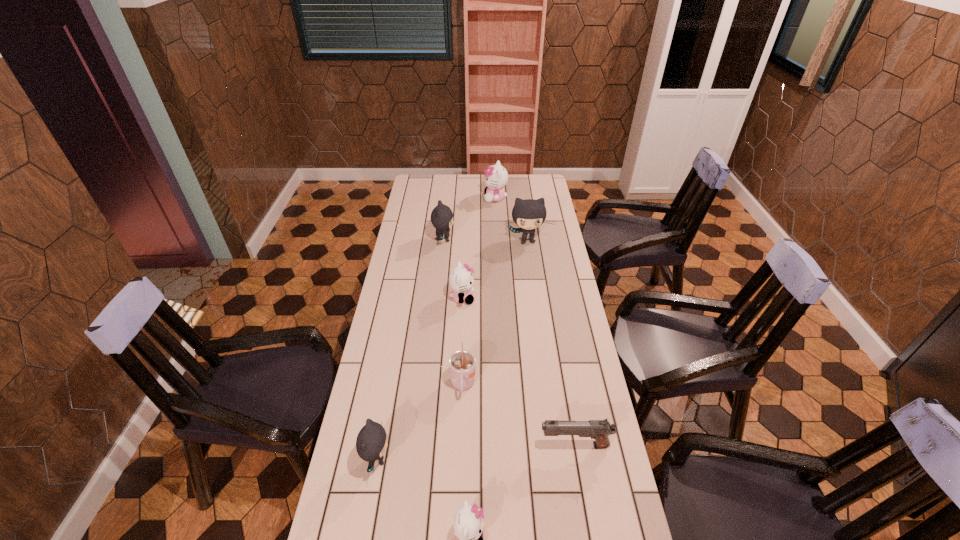
Locate an element on the screen. This screenshot has height=540, width=960. the rightmost gray kitten is located at coordinates (529, 214).

Locate an element on the screen. This screenshot has width=960, height=540. the rightmost white kitten is located at coordinates (496, 177).

In order to click on the farthest kitten in this screenshot , I will do `click(496, 177)`.

The image size is (960, 540). What are the coordinates of `the second gray kitten from right to left` in the screenshot? It's located at (441, 216).

Where is `the second smallest white kitten`? The width and height of the screenshot is (960, 540). the second smallest white kitten is located at coordinates (461, 281).

At what (x,y) coordinates should I click in order to perform the action: click on the second farthest white kitten. Please return your answer as a coordinate pair (x, y). The image size is (960, 540). Looking at the image, I should click on (461, 281).

I want to click on the leftmost kitten, so [371, 443].

Where is `the smallest gray kitten`? The image size is (960, 540). the smallest gray kitten is located at coordinates (371, 443).

The height and width of the screenshot is (540, 960). Identify the location of cup. point(461,363).

You are a GUI agent. You are given a task and a screenshot of the screen. Output one action in this format:
    pyautogui.click(x=<x>, y=<y>)
    Task: Click on the gray gun
    This screenshot has width=960, height=540.
    Given the screenshot: What is the action you would take?
    pyautogui.click(x=599, y=430)